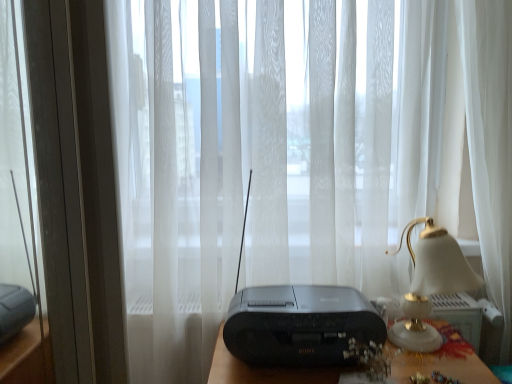
Question: Can you confirm if transparent glass door at left is positioned to the left of matte gold lampshade at right?

Choices:
 (A) no
 (B) yes

Answer: (B)

Question: Does transparent glass door at left have a larger size compared to matte gold lampshade at right?

Choices:
 (A) no
 (B) yes

Answer: (B)

Question: Is transparent glass door at left positioned in front of matte gold lampshade at right?

Choices:
 (A) yes
 (B) no

Answer: (B)

Question: Can you confirm if transparent glass door at left is thinner than matte gold lampshade at right?

Choices:
 (A) yes
 (B) no

Answer: (A)

Question: From a real-world perspective, is transparent glass door at left below matte gold lampshade at right?

Choices:
 (A) yes
 (B) no

Answer: (B)

Question: Is transparent glass door at left to the right of matte gold lampshade at right from the viewer's perspective?

Choices:
 (A) yes
 (B) no

Answer: (B)

Question: Is black plastic radio at center outside of black plastic radio at center?

Choices:
 (A) yes
 (B) no

Answer: (B)

Question: Is black plastic radio at center turned away from black plastic radio at center?

Choices:
 (A) no
 (B) yes

Answer: (B)

Question: Does black plastic radio at center contain black plastic radio at center?

Choices:
 (A) yes
 (B) no

Answer: (B)

Question: From a real-world perspective, is black plastic radio at center on top of black plastic radio at center?

Choices:
 (A) no
 (B) yes

Answer: (A)

Question: Is black plastic radio at center aimed at black plastic radio at center?

Choices:
 (A) yes
 (B) no

Answer: (A)

Question: Does black plastic radio at center touch black plastic radio at center?

Choices:
 (A) no
 (B) yes

Answer: (B)

Question: From the image's perspective, is black plastic radio at center beneath black plastic radio at center?

Choices:
 (A) no
 (B) yes

Answer: (A)